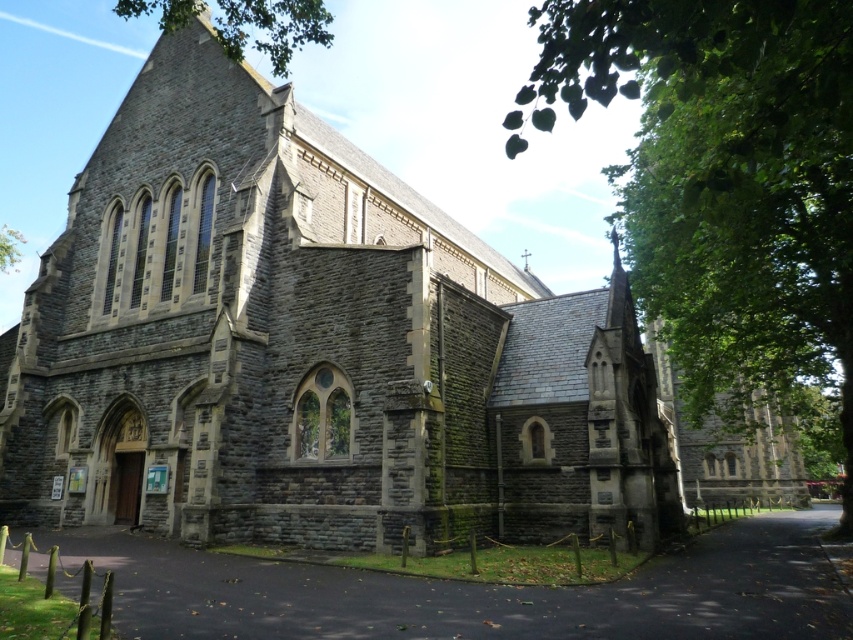
Can you confirm if green leafy tree at right is wider than green leafy tree at upper left?

In fact, green leafy tree at right might be narrower than green leafy tree at upper left.

Image resolution: width=853 pixels, height=640 pixels. What do you see at coordinates (726, 177) in the screenshot?
I see `green leafy tree at right` at bounding box center [726, 177].

You are a GUI agent. You are given a task and a screenshot of the screen. Output one action in this format:
    pyautogui.click(x=<x>, y=<y>)
    Task: Click on the green leafy tree at right
    
    Given the screenshot: What is the action you would take?
    [x=726, y=177]

Can you confirm if gray stone church at center is smaller than green leafy tree at right?

Yes.

Is gray stone church at center shorter than green leafy tree at right?

Correct, gray stone church at center is not as tall as green leafy tree at right.

This screenshot has height=640, width=853. What are the coordinates of `gray stone church at center` in the screenshot? It's located at (309, 348).

Which of these two, gray stone church at center or green leafy tree at upper left, stands taller?

gray stone church at center

Does gray stone church at center have a larger size compared to green leafy tree at upper left?

Yes, gray stone church at center is bigger than green leafy tree at upper left.

Which is behind, point (425, 420) or point (10, 232)?

The point (10, 232) is more distant.

At what (x,y) coordinates should I click in order to perform the action: click on gray stone church at center. Please return your answer as a coordinate pair (x, y). The image size is (853, 640). Looking at the image, I should click on (309, 348).